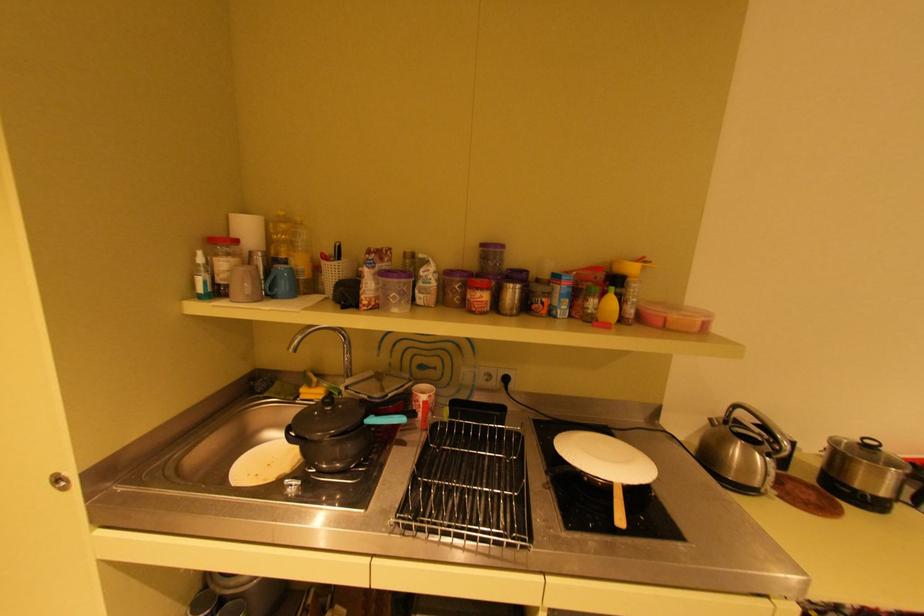
Which object does [606,310] point to?

This point indicates the yellow squeeze bottle.